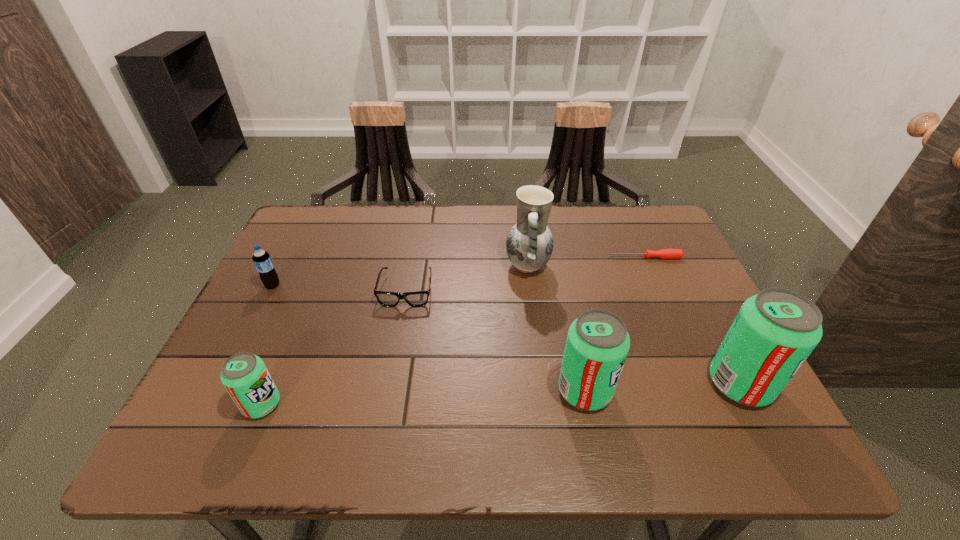
I want to click on object that is at the far edge, so click(529, 245).

Where is `pop soda that is positioned at the right edge`? pop soda that is positioned at the right edge is located at coordinates (774, 332).

This screenshot has width=960, height=540. What are the coordinates of `screwdriver that is at the right edge` in the screenshot? It's located at (664, 253).

Identify the location of object that is at the near left corner. [244, 375].

Find the location of a particular element. This screenshot has height=540, width=960. object situated at the near right corner is located at coordinates (774, 332).

Find the location of a particular element. The height and width of the screenshot is (540, 960). free space at the far edge of the desktop is located at coordinates point(576,250).

Locate an element on the screen. blank space at the near edge of the desktop is located at coordinates (480, 391).

The image size is (960, 540). Identify the location of vacant space at the left edge of the desktop. (292, 352).

In the image, there is a desktop. Where is `vacant space at the right edge`? This screenshot has width=960, height=540. vacant space at the right edge is located at coordinates (639, 276).

In the image, there is a desktop. Where is `vacant area at the far left corner`? The height and width of the screenshot is (540, 960). vacant area at the far left corner is located at coordinates (320, 235).